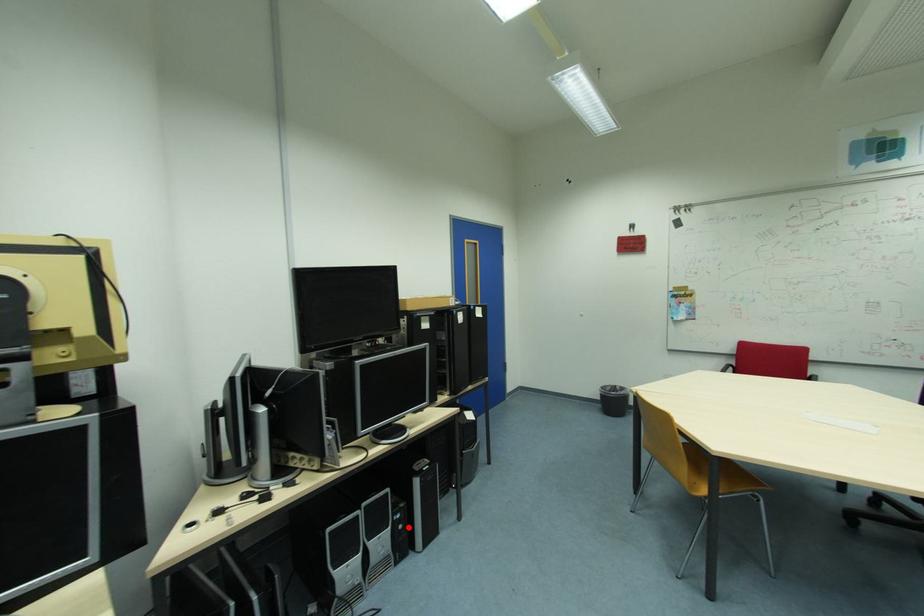
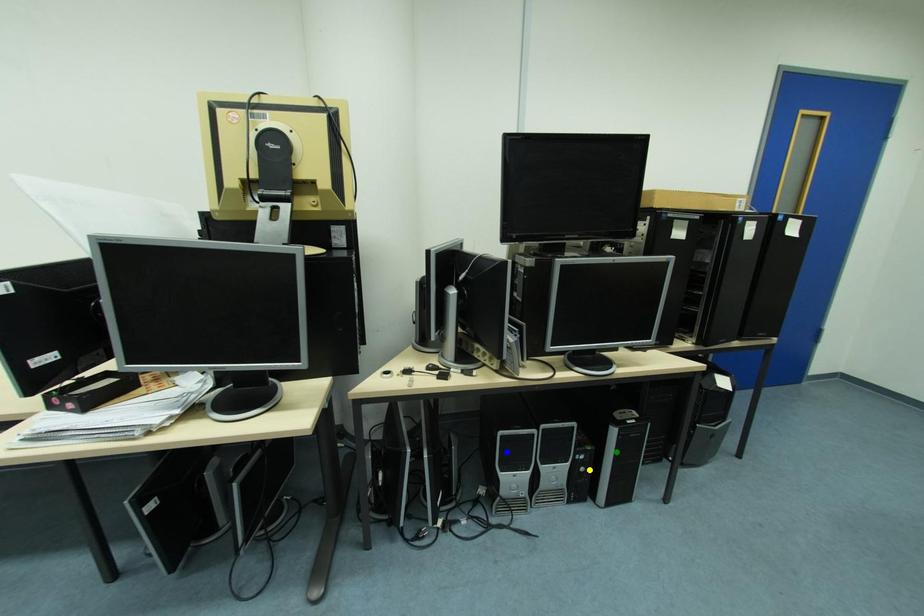
Question: I am providing you with two images of the same scene from different viewpoints. A red point is marked on the first image. You are given multiple points on the second image. Which point in image 2 represents the same 3d spot as the red point in image 1?

Choices:
 (A) yellow point
 (B) green point
 (C) blue point

Answer: (A)